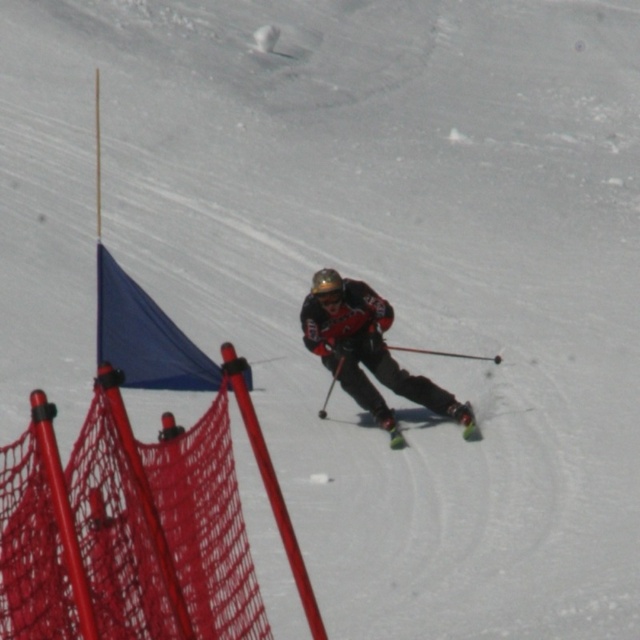
Question: In this image, where is matte black ski suit at center located relative to green matte ski at center?

Choices:
 (A) right
 (B) left

Answer: (B)

Question: Considering the relative positions of matte black ski suit at center and green matte ski at center in the image provided, where is matte black ski suit at center located with respect to green matte ski at center?

Choices:
 (A) left
 (B) right

Answer: (A)

Question: Which of the following is the farthest from the observer?

Choices:
 (A) (394, 432)
 (B) (300, 316)

Answer: (B)

Question: Which point appears farthest from the camera in this image?

Choices:
 (A) (472, 440)
 (B) (368, 410)

Answer: (B)

Question: From the image, what is the correct spatial relationship of matte black ski suit at center in relation to green matte ski at center?

Choices:
 (A) left
 (B) right

Answer: (A)